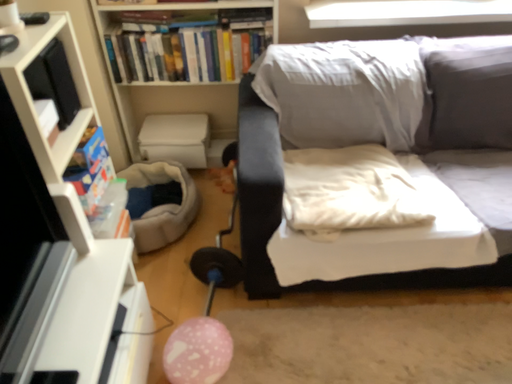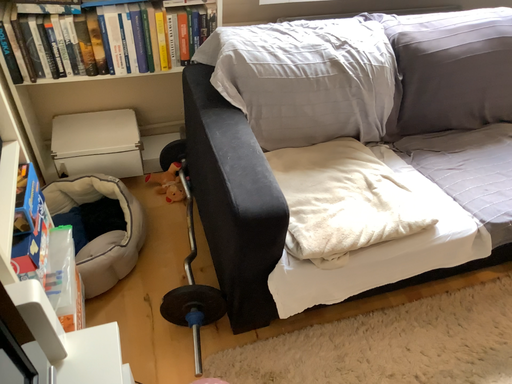
Question: How did the camera likely rotate when shooting the video?

Choices:
 (A) rotated left
 (B) rotated right

Answer: (B)